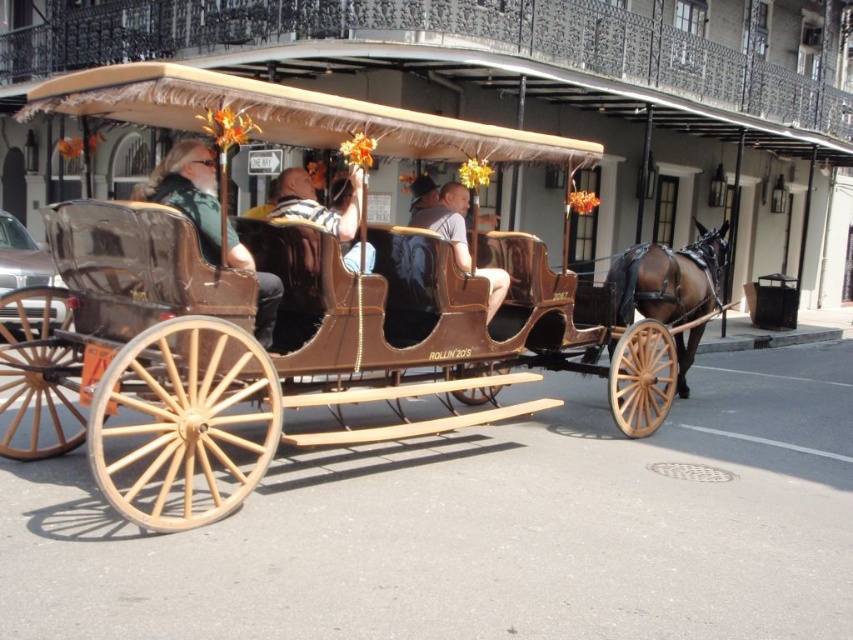
Question: Estimate the real-world distances between objects in this image. Which object is farther from the metallic silver car at left?

Choices:
 (A) matte brown leather jacket at center
 (B) brown leather horse at right
 (C) shiny brown wood horse cart at center

Answer: (B)

Question: Which is farther from the striped shirt at center?

Choices:
 (A) shiny brown wood horse cart at center
 (B) metallic silver car at left
 (C) matte brown vest at left

Answer: (B)

Question: Which point is farther to the camera?

Choices:
 (A) metallic silver car at left
 (B) matte brown leather jacket at center
 (C) shiny brown wood horse cart at center
 (D) striped shirt at center

Answer: (A)

Question: Does brown leather horse at right appear on the right side of metallic silver car at left?

Choices:
 (A) yes
 (B) no

Answer: (A)

Question: Observing the image, what is the correct spatial positioning of matte brown vest at left in reference to matte brown leather jacket at center?

Choices:
 (A) below
 (B) above

Answer: (A)

Question: Is shiny brown wood horse cart at center to the left of metallic silver car at left from the viewer's perspective?

Choices:
 (A) yes
 (B) no

Answer: (B)